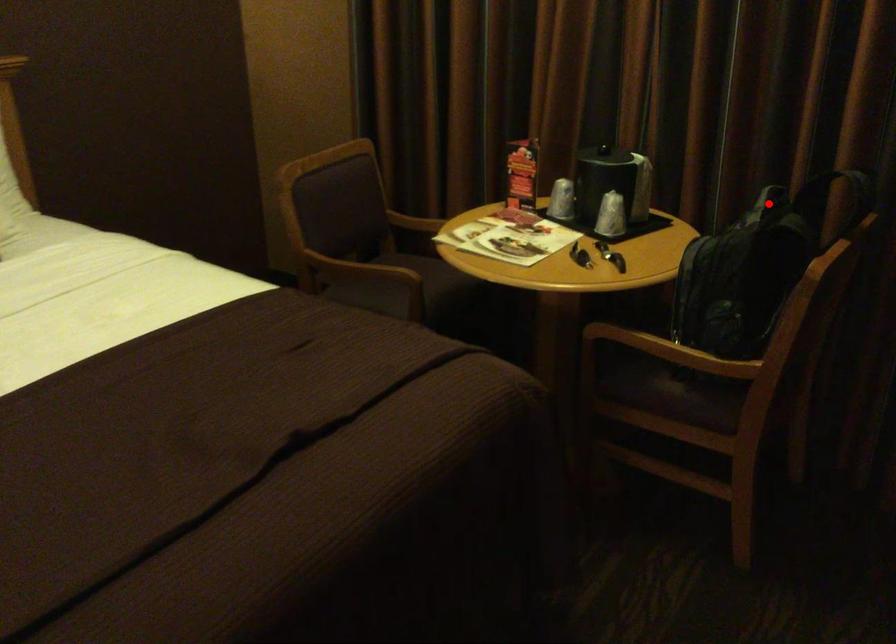
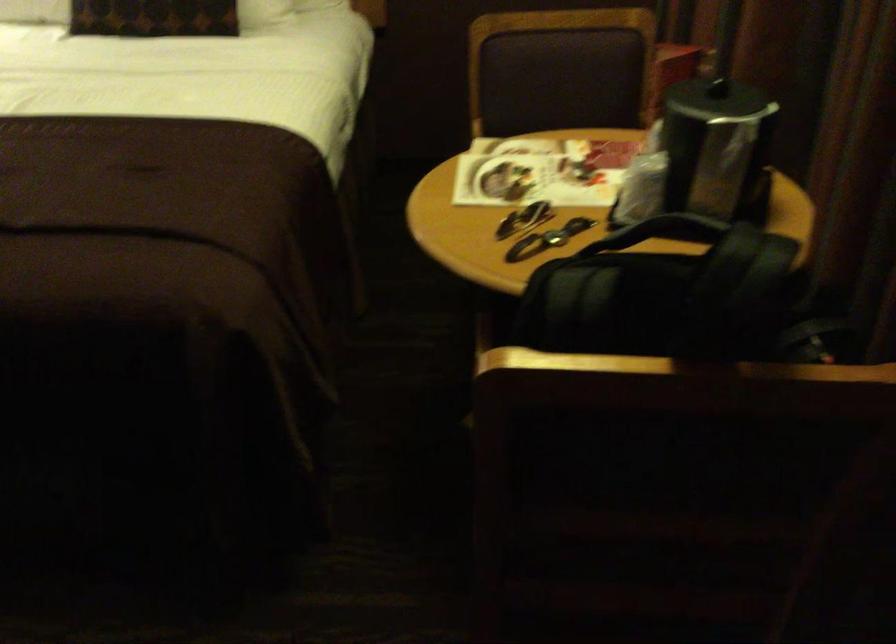
Where in the second image is the point corresponding to the highlighted location from the first image?

(670, 229)